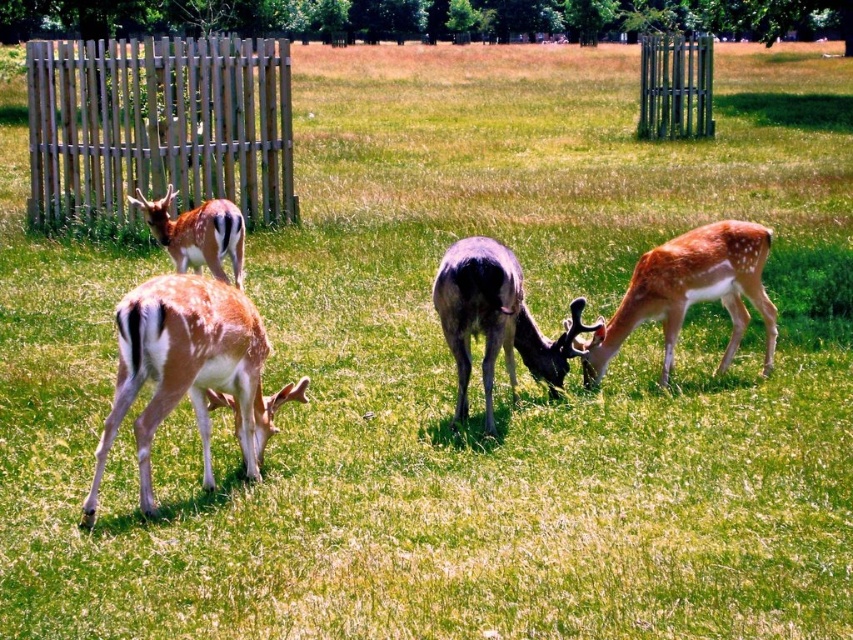
Question: Can you confirm if wooden fence at left is wider than shiny brown antlers at center?

Choices:
 (A) no
 (B) yes

Answer: (B)

Question: Which of the following is the closest to the observer?

Choices:
 (A) fawn fur deer at lower left
 (B) wooden fence at left

Answer: (A)

Question: Which object is farther from the camera taking this photo?

Choices:
 (A) fawn fur deer at left
 (B) wooden fence at left
 (C) fawn fur deer at lower left

Answer: (B)

Question: Which of the following is the farthest from the observer?

Choices:
 (A) (228, 358)
 (B) (693, 125)
 (C) (38, 54)

Answer: (B)

Question: Can you confirm if wooden fence at left is wider than fawn fur deer at left?

Choices:
 (A) yes
 (B) no

Answer: (A)

Question: Does green wooden fence at upper right appear on the right side of fawn fur deer at left?

Choices:
 (A) no
 (B) yes

Answer: (B)